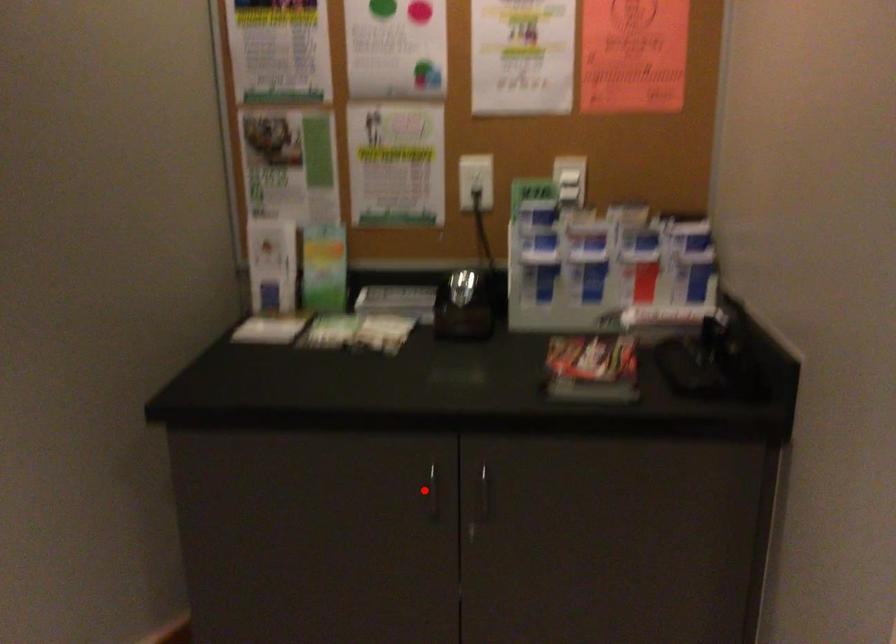
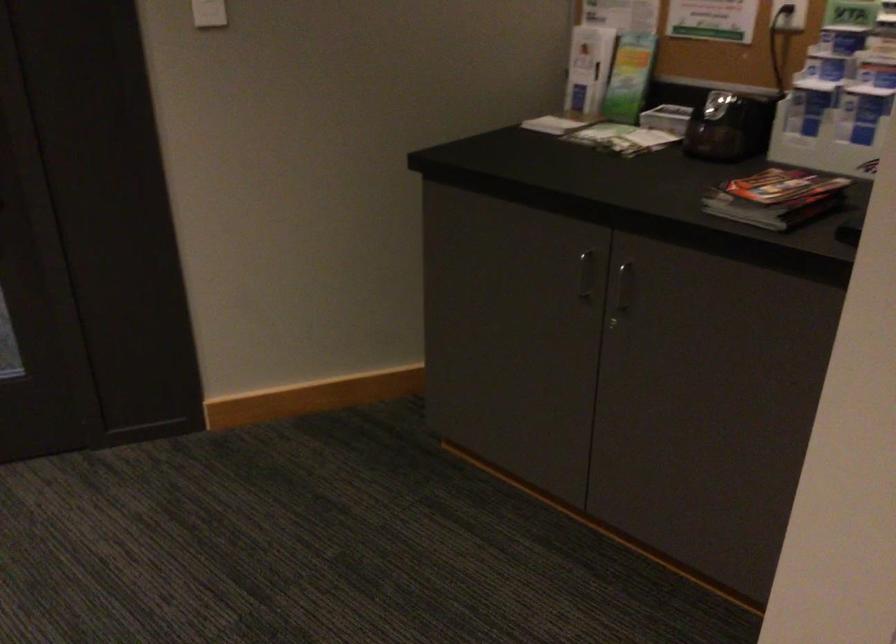
Where in the second image is the point corresponding to the highlighted location from the first image?

(584, 275)